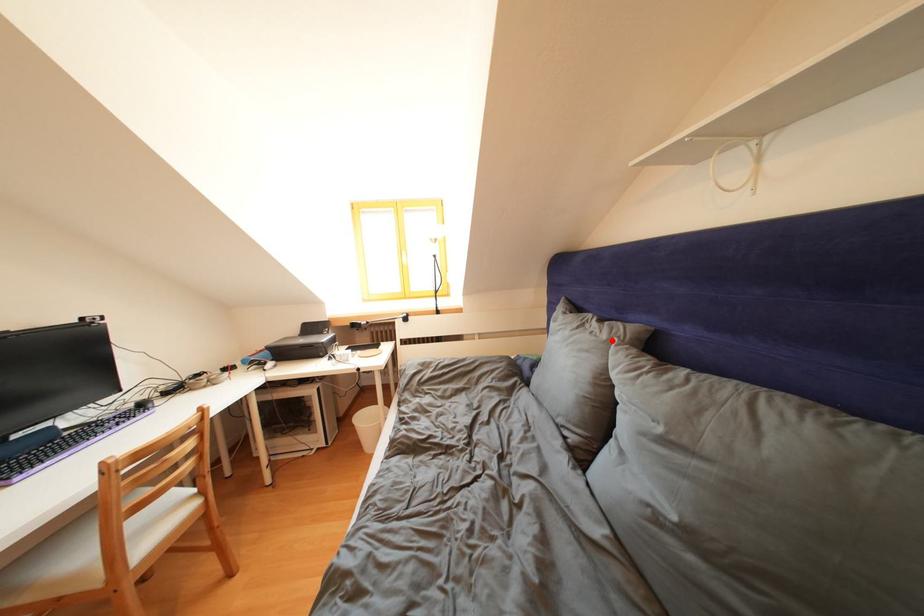
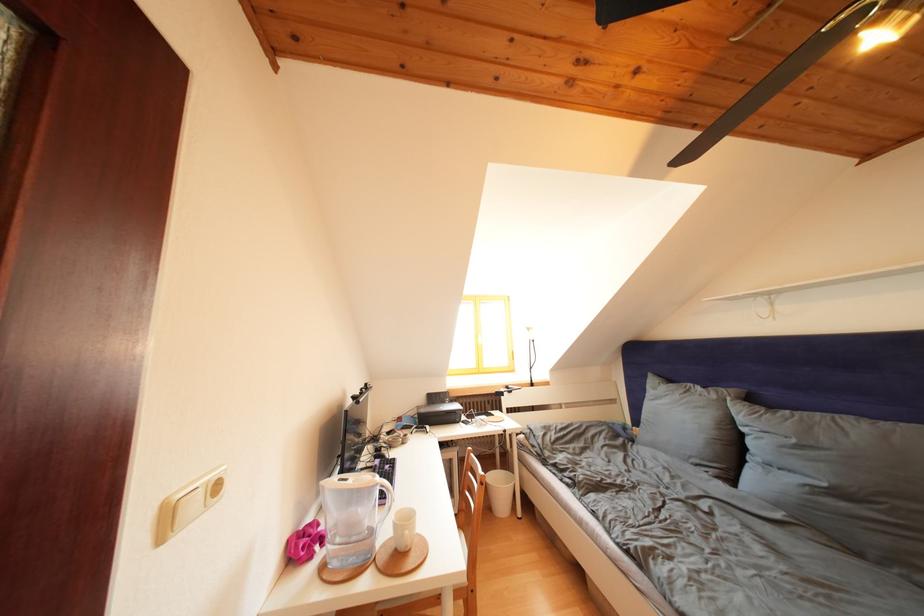
Where in the second image is the point corresponding to the highlighted location from the first image?

(722, 402)